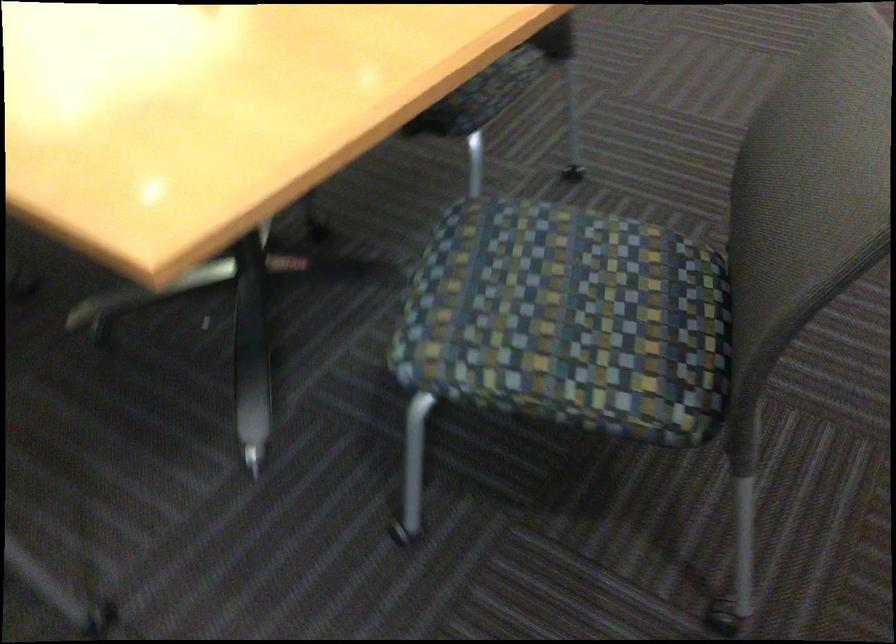
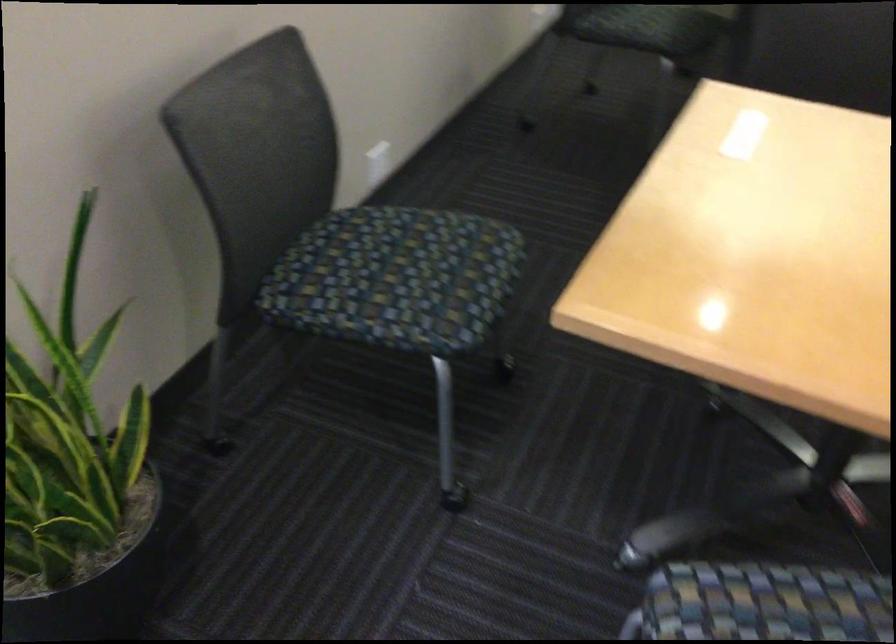
Locate, in the second image, the point that corresponds to (x=484, y=295) in the first image.

(765, 603)